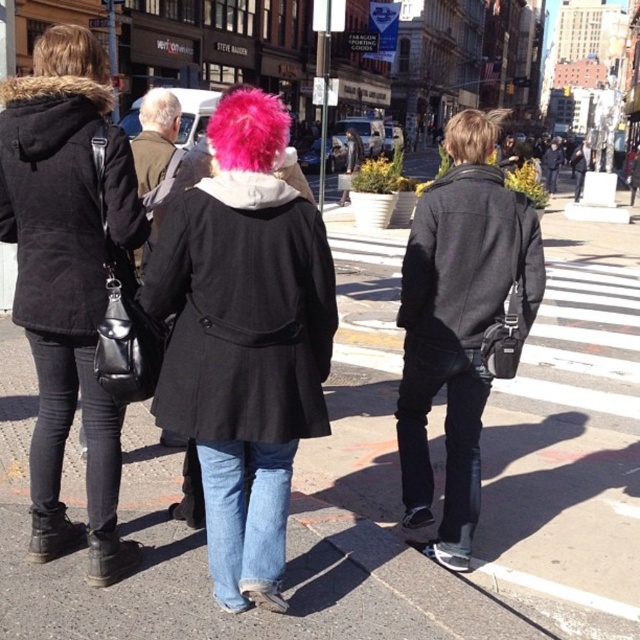
Which is behind, point (406, 456) or point (435, 291)?

Positioned behind is point (406, 456).

Can you confirm if matte black coat at center is positioned above dark gray wool coat at center?

Actually, matte black coat at center is below dark gray wool coat at center.

Is point (474, 147) in front of point (404, 256)?

Yes, point (474, 147) is in front of point (404, 256).

Locate an element on the screen. This screenshot has width=640, height=640. matte black coat at center is located at coordinates (461, 323).

Does matte black coat at center appear under gray matte hair at upper left?

Indeed, matte black coat at center is positioned under gray matte hair at upper left.

What do you see at coordinates (461, 323) in the screenshot? I see `matte black coat at center` at bounding box center [461, 323].

Between point (433, 230) and point (150, 124), which one is positioned in front?

Positioned in front is point (433, 230).

Where is `matte black coat at center`? matte black coat at center is located at coordinates (461, 323).

Which is in front, point (253, 236) or point (154, 99)?

Point (253, 236) is in front.

Is the position of black wool coat at center less distant than that of gray matte hair at upper left?

That is True.

Find the location of a particular element. This screenshot has width=640, height=640. black wool coat at center is located at coordinates (241, 310).